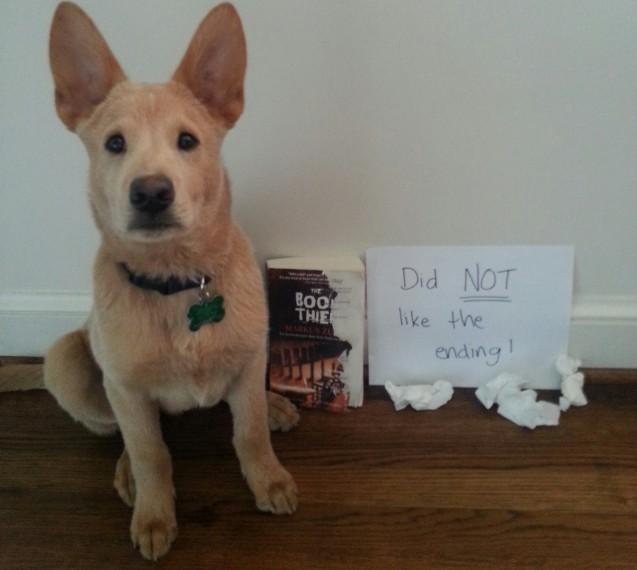
Find the location of a particular element. pages of book is located at coordinates (337, 260).